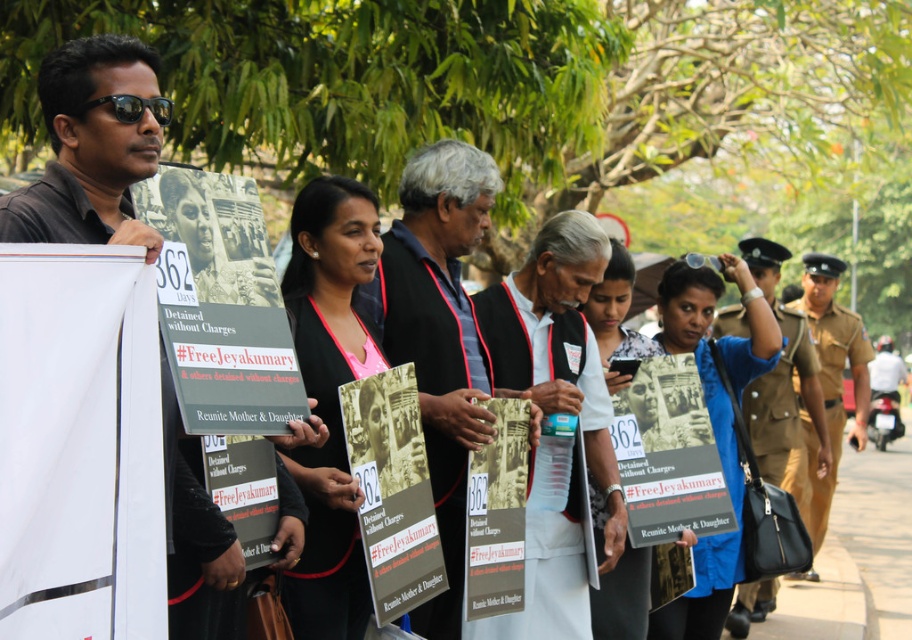
Question: Which object is closer to the camera taking this photo?

Choices:
 (A) matte black signboard at center
 (B) matte black vest at center
 (C) brown uniform at right

Answer: (B)

Question: Is matte black vest at center below blue fabric shirt at center?

Choices:
 (A) yes
 (B) no

Answer: (B)

Question: Considering the real-world distances, which object is farthest from the brown uniform at right?

Choices:
 (A) matte black shirt at left
 (B) matte black vest at center

Answer: (A)

Question: Is matte black shirt at left to the left of matte black signboard at center from the viewer's perspective?

Choices:
 (A) no
 (B) yes

Answer: (B)

Question: Is brown uniform at right smaller than matte black signboard at center?

Choices:
 (A) yes
 (B) no

Answer: (B)

Question: Which point is farther to the camera?

Choices:
 (A) matte black shirt at left
 (B) white cloth vest at center
 (C) matte black sign at center
 (D) blue fabric shirt at center

Answer: (D)